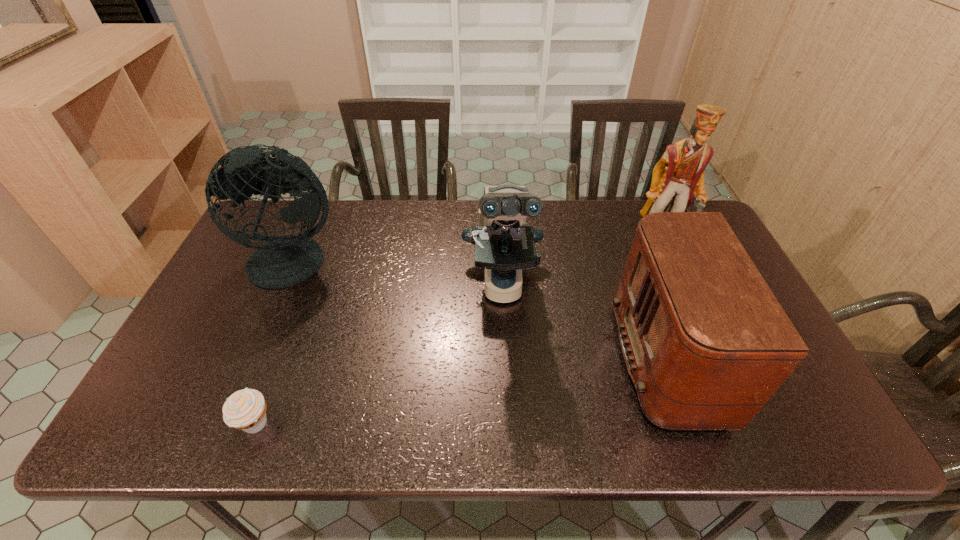
At what (x,y) coordinates should I click in order to perform the action: click on vacant space that satisfies the following two spatial constraints: 1. on the front-facing side of the nutcracker; 2. on the front panel of the radio receiver. Please return your answer as a coordinate pair (x, y). The image size is (960, 540). Looking at the image, I should click on (714, 360).